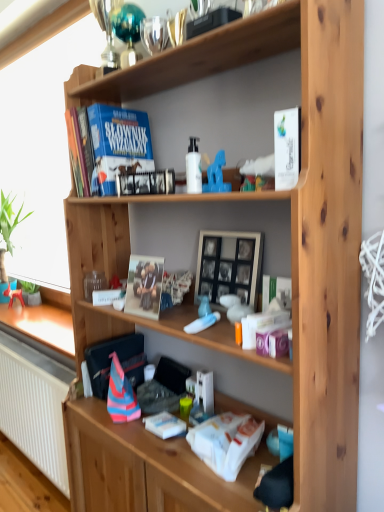
This screenshot has height=512, width=384. What do you see at coordinates (144, 286) in the screenshot?
I see `matte cardboard photo frame at center, the second paperback book from the left` at bounding box center [144, 286].

What is the approximate height of hardcover book at upper center, which is the 1th paperback book in top-to-bottom order?

It is 29.32 centimeters.

The width and height of the screenshot is (384, 512). What do you see at coordinates (119, 144) in the screenshot?
I see `hardcover book at upper center, which is the 3th paperback book in front-to-back order` at bounding box center [119, 144].

In order to click on white glossy paperback book at upper right, positioned as the first paperback book in right-to-left order in this screenshot , I will do `click(287, 148)`.

Locate an element on the screen. The height and width of the screenshot is (512, 384). wooden picture frame at center is located at coordinates (229, 266).

In the scene shown: Considering the relative sizes of white glossy bottle at center and white glossy paperback book at upper right, arranged as the second paperback book when ordered from the bottom, in the image provided, is white glossy bottle at center thinner than white glossy paperback book at upper right, arranged as the second paperback book when ordered from the bottom,?

Yes.

From a real-world perspective, count 1st paperback books upward from the white glossy bottle at center and point to it. Please provide its 2D coordinates.

[(287, 148)]

Considering the points (198, 161) and (292, 165), which point is in front, point (198, 161) or point (292, 165)?

Point (292, 165)

Measure the distance between white glossy bottle at center and white glossy paperback book at upper right, positioned as the first paperback book in right-to-left order.

10.52 inches.

From the image's perspective, is translucent plastic container at middle over wooden picture frame at center?

Incorrect, from the image's perspective, translucent plastic container at middle is lower than wooden picture frame at center.

Is translucent plastic container at middle smaller than wooden picture frame at center?

Indeed, translucent plastic container at middle has a smaller size compared to wooden picture frame at center.

Considering the relative sizes of translucent plastic container at middle and wooden picture frame at center in the image provided, is translucent plastic container at middle taller than wooden picture frame at center?

No.

Is translucent plastic container at middle in front of or behind wooden picture frame at center in the image?

translucent plastic container at middle is in front of wooden picture frame at center.

Between point (100, 180) and point (32, 291), which one is positioned in front?

The point (100, 180) is in front.

Which object is positioned more to the left, hardcover book at upper center, placed as the third paperback book when sorted from right to left, or green matte plant at lower left?

green matte plant at lower left is more to the left.

Considering the sizes of objects hardcover book at upper center, acting as the third paperback book starting from the bottom, and green matte plant at lower left in the image provided, who is wider, hardcover book at upper center, acting as the third paperback book starting from the bottom, or green matte plant at lower left?

hardcover book at upper center, acting as the third paperback book starting from the bottom.

How many degrees apart are the facing directions of hardcover book at upper center, which is the 3th paperback book in front-to-back order, and matte cardboard photo frame at center, the first paperback book from the bottom?

The facing directions of hardcover book at upper center, which is the 3th paperback book in front-to-back order, and matte cardboard photo frame at center, the first paperback book from the bottom, are 7.03 degrees apart.

Considering the relative sizes of hardcover book at upper center, the first paperback book in the left-to-right sequence, and matte cardboard photo frame at center, the first paperback book from the bottom, in the image provided, is hardcover book at upper center, the first paperback book in the left-to-right sequence, thinner than matte cardboard photo frame at center, the first paperback book from the bottom,?

No, hardcover book at upper center, the first paperback book in the left-to-right sequence, is not thinner than matte cardboard photo frame at center, the first paperback book from the bottom.

Who is smaller, hardcover book at upper center, which is the 3th paperback book in front-to-back order, or matte cardboard photo frame at center, the 2th paperback book positioned from the right?

With smaller size is matte cardboard photo frame at center, the 2th paperback book positioned from the right.

Looking at this image, from the image's perspective, is hardcover book at upper center, which is the 3th paperback book in front-to-back order, above matte cardboard photo frame at center, the second paperback book positioned from the front?

Indeed, from the image's perspective, hardcover book at upper center, which is the 3th paperback book in front-to-back order, is shown above matte cardboard photo frame at center, the second paperback book positioned from the front.

From the image's perspective, would you say white glossy bottle at center is shown under matte cardboard photo frame at center, the second paperback book positioned from the front?

No, from the image's perspective, white glossy bottle at center is not below matte cardboard photo frame at center, the second paperback book positioned from the front.

Does white glossy bottle at center lie behind matte cardboard photo frame at center, the second paperback book from the left?

A: No, white glossy bottle at center is in front of matte cardboard photo frame at center, the second paperback book from the left.

Consider the image. Between white glossy bottle at center and matte cardboard photo frame at center, the second paperback book from the left, which one has more height?

matte cardboard photo frame at center, the second paperback book from the left, is taller.

Is white glossy bottle at center not within matte cardboard photo frame at center, the second paperback book from the left?

Yes.

Consider the image. Could you tell me if matte cardboard photo frame at center, the first paperback book from the bottom, is facing hardcover book at upper center, marked as the first paperback book in a back-to-front arrangement?

No, matte cardboard photo frame at center, the first paperback book from the bottom, is not oriented towards hardcover book at upper center, marked as the first paperback book in a back-to-front arrangement.

Considering the sizes of objects matte cardboard photo frame at center, the first paperback book from the bottom, and hardcover book at upper center, placed as the third paperback book when sorted from right to left, in the image provided, who is thinner, matte cardboard photo frame at center, the first paperback book from the bottom, or hardcover book at upper center, placed as the third paperback book when sorted from right to left,?

matte cardboard photo frame at center, the first paperback book from the bottom.

Is point (132, 267) more distant than point (95, 126)?

No, it is in front of (95, 126).

Considering the sizes of objects green matte plant at lower left and white glossy bottle at center in the image provided, who is wider, green matte plant at lower left or white glossy bottle at center?

With larger width is green matte plant at lower left.

How many degrees apart are the facing directions of green matte plant at lower left and white glossy bottle at center?

0.177 degrees.

From the image's perspective, which is above, green matte plant at lower left or white glossy bottle at center?

white glossy bottle at center.

Are green matte plant at lower left and white glossy bottle at center beside each other?

No, green matte plant at lower left is not beside white glossy bottle at center.

Where is `bottle that is above the white glossy paperback book at upper right, placed as the first paperback book when sorted from front to back (from the image's perspective)`? The width and height of the screenshot is (384, 512). bottle that is above the white glossy paperback book at upper right, placed as the first paperback book when sorted from front to back (from the image's perspective) is located at coordinates (193, 167).

Image resolution: width=384 pixels, height=512 pixels. Identify the location of picture frame on the left of the translucent plastic container at middle. (229, 266).

Based on their spatial positions, is white glossy bottle at center or hardcover book at upper center, the first paperback book in the left-to-right sequence, closer to translucent plastic container at middle?

white glossy bottle at center is positioned closer to the anchor translucent plastic container at middle.

When comparing their distances from wooden picture frame at center, does hardcover book at upper center, acting as the third paperback book starting from the bottom, or translucent plastic container at middle seem further?

hardcover book at upper center, acting as the third paperback book starting from the bottom, lies further to wooden picture frame at center than the other object.

In the scene shown: Which object lies further to the anchor point matte cardboard photo frame at center, the second paperback book from the left, wooden picture frame at center or green matte plant at lower left?

green matte plant at lower left is positioned further to the anchor matte cardboard photo frame at center, the second paperback book from the left.

From the image, which object appears to be farther from white glossy paperback book at upper right, arranged as the second paperback book when ordered from the bottom, hardcover book at upper center, marked as the first paperback book in a back-to-front arrangement, or white glossy bottle at center?

The object further to white glossy paperback book at upper right, arranged as the second paperback book when ordered from the bottom, is hardcover book at upper center, marked as the first paperback book in a back-to-front arrangement.

From the image, which object appears to be nearer to white glossy bottle at center, matte cardboard photo frame at center, which is the 2th paperback book from back to front, or hardcover book at upper center, acting as the third paperback book starting from the bottom?

Based on the image, hardcover book at upper center, acting as the third paperback book starting from the bottom, appears to be nearer to white glossy bottle at center.

Which object lies further to the anchor point hardcover book at upper center, the first paperback book in the left-to-right sequence, white glossy bottle at center or translucent plastic container at middle?

translucent plastic container at middle lies further to hardcover book at upper center, the first paperback book in the left-to-right sequence, than the other object.

Which object lies further to the anchor point wooden picture frame at center, white glossy paperback book at upper right, the third paperback book positioned from the left, or white glossy bottle at center?

The object further to wooden picture frame at center is white glossy paperback book at upper right, the third paperback book positioned from the left.

From the picture: Considering their positions, is matte cardboard photo frame at center, the second paperback book from the left, positioned closer to green matte plant at lower left than white glossy bottle at center?

matte cardboard photo frame at center, the second paperback book from the left, lies closer to green matte plant at lower left than the other object.

The width and height of the screenshot is (384, 512). I want to click on bottle between white glossy paperback book at upper right, the third paperback book positioned from the left, and wooden picture frame at center in the front-back direction, so point(193,167).

This screenshot has height=512, width=384. Identify the location of picture frame between hardcover book at upper center, which is the 3th paperback book in front-to-back order, and matte cardboard photo frame at center, the 2th paperback book positioned from the right, from top to bottom. (229, 266).

You are a GUI agent. You are given a task and a screenshot of the screen. Output one action in this format:
    pyautogui.click(x=<x>, y=<y>)
    Task: Click on the toy positioned between white glossy paperback book at upper right, arranged as the second paperback book when ordered from the bottom, and green matte plant at lower left from near to far
    
    Given the screenshot: What is the action you would take?
    pyautogui.click(x=235, y=307)

Identify the location of bottle between hardcover book at upper center, which is the 1th paperback book in top-to-bottom order, and wooden picture frame at center vertically. (193, 167).